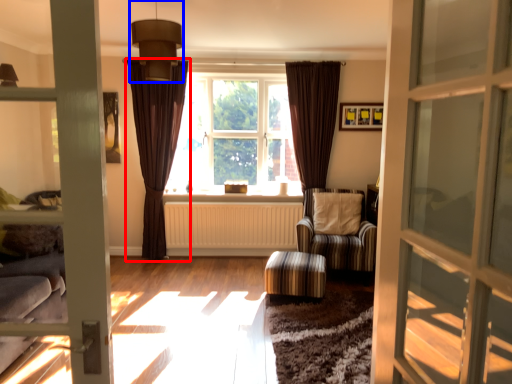
Question: Which object appears farthest to the camera in this image, curtain (highlighted by a red box) or light fixture (highlighted by a blue box)?

Choices:
 (A) curtain
 (B) light fixture

Answer: (A)